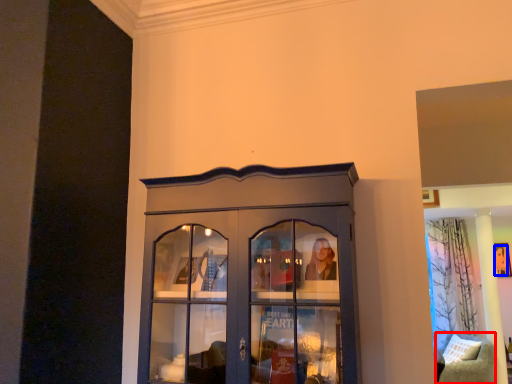
Question: Which point is closer to the camera, furniture (highlighted by a red box) or person (highlighted by a blue box)?

Choices:
 (A) furniture
 (B) person

Answer: (A)